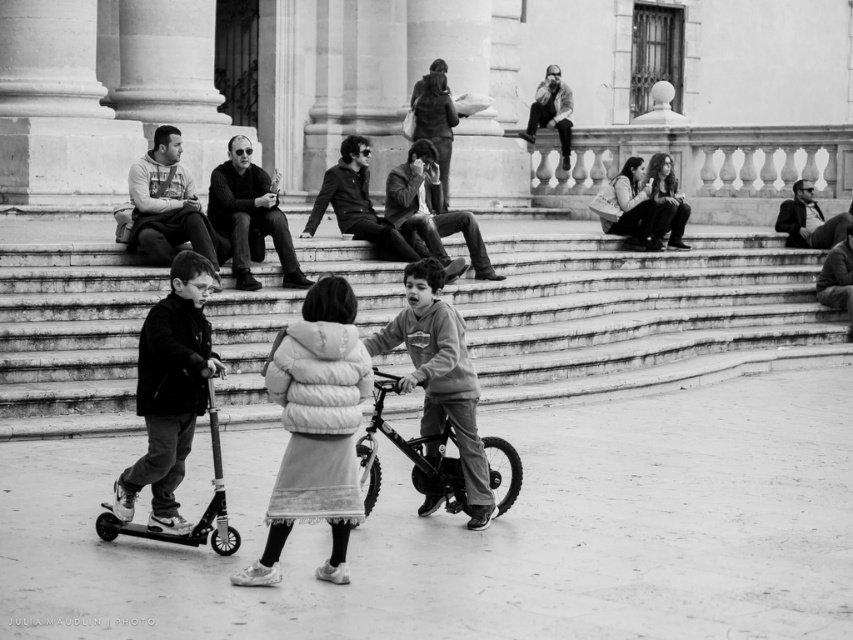
Question: Which object appears closest to the camera in this image?

Choices:
 (A) metallic silver bicycle at center
 (B) white fluffy coat at center
 (C) dark gray fleece jacket at center
 (D) smooth concrete stairs at center

Answer: (B)

Question: Can you confirm if smooth concrete stairs at center is positioned below dark gray fleece jacket at center?

Choices:
 (A) no
 (B) yes

Answer: (A)

Question: Which object is positioned closest to the smooth concrete stairs at center?

Choices:
 (A) dark gray fleece jacket at center
 (B) metallic silver bicycle at center
 (C) white fluffy coat at center

Answer: (B)

Question: Does smooth concrete stairs at center appear on the right side of dark gray fleece jacket at center?

Choices:
 (A) yes
 (B) no

Answer: (A)

Question: Is smooth concrete stairs at center above metallic silver bicycle at center?

Choices:
 (A) yes
 (B) no

Answer: (A)

Question: Which of the following is the closest to the observer?

Choices:
 (A) metallic silver bicycle at center
 (B) dark gray fleece jacket at center
 (C) smooth concrete stairs at center

Answer: (B)